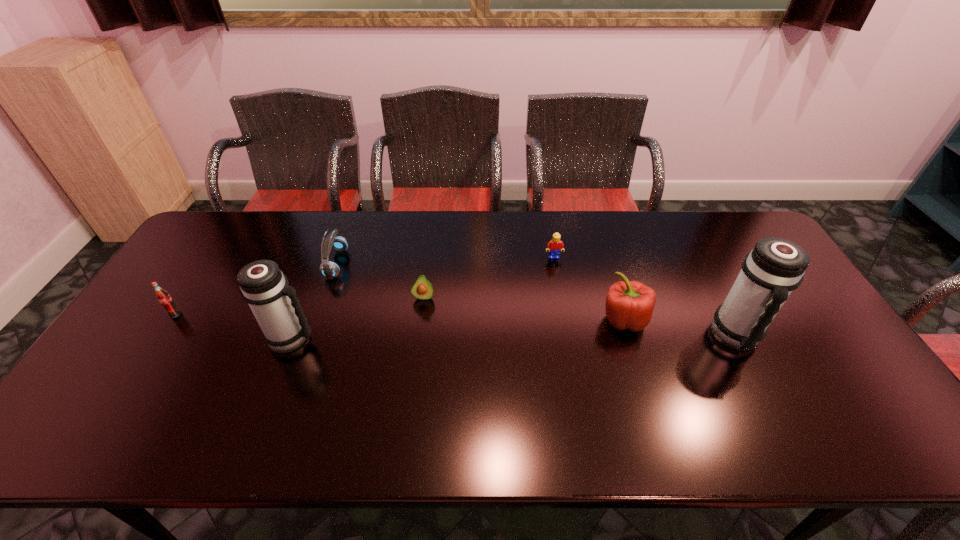
The width and height of the screenshot is (960, 540). In order to click on vacant area between the avocado and the shorter thermos bottle in this screenshot , I will do (357, 318).

Where is `free point between the sixth object from left to right and the fifth object from left to right`? Image resolution: width=960 pixels, height=540 pixels. free point between the sixth object from left to right and the fifth object from left to right is located at coordinates (589, 288).

I want to click on unoccupied position between the shorter thermos bottle and the bell pepper, so click(458, 329).

Find the location of `vacant region between the shorter thermos bottle and the headset`. vacant region between the shorter thermos bottle and the headset is located at coordinates (314, 301).

At what (x,y) coordinates should I click in order to perform the action: click on the second closest object to the left thermos bottle. Please return your answer as a coordinate pair (x, y). Looking at the image, I should click on (422, 289).

Select which object is the closest to the third farthest object. Please provide its 2D coordinates. Your answer should be formatted as a tuple, i.e. [(x, y)], where the tuple contains the x and y coordinates of a point satisfying the conditions above.

[(334, 240)]

I want to click on vacant position in the image that satisfies the following two spatial constraints: 1. on the label of the second object from right to left; 2. on the left side of the leftmost object, so click(x=172, y=320).

At what (x,y) coordinates should I click in order to perform the action: click on free point that satisfies the following two spatial constraints: 1. on the label of the soda bottle; 2. on the left side of the sixth object from left to right. Please return your answer as a coordinate pair (x, y). This screenshot has width=960, height=540. Looking at the image, I should click on (172, 320).

Find the location of a particular element. This screenshot has width=960, height=540. free location that satisfies the following two spatial constraints: 1. on the front-facing side of the Lego; 2. on the ear cups of the headset is located at coordinates (555, 264).

Identify the location of free spot that satisfies the following two spatial constraints: 1. on the front-facing side of the fifth object from left to right; 2. on the side with the handle of the second tallest object. Image resolution: width=960 pixels, height=540 pixels. tap(568, 338).